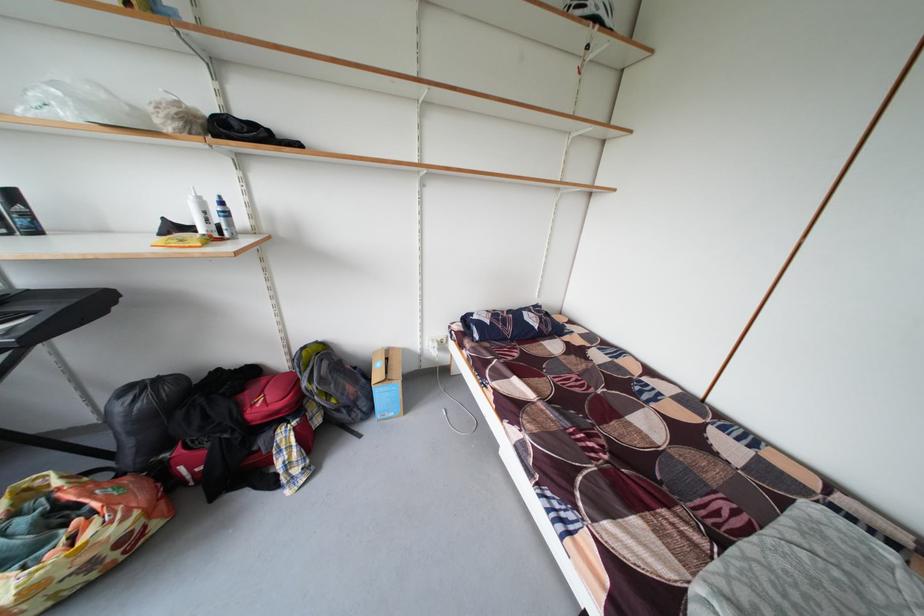
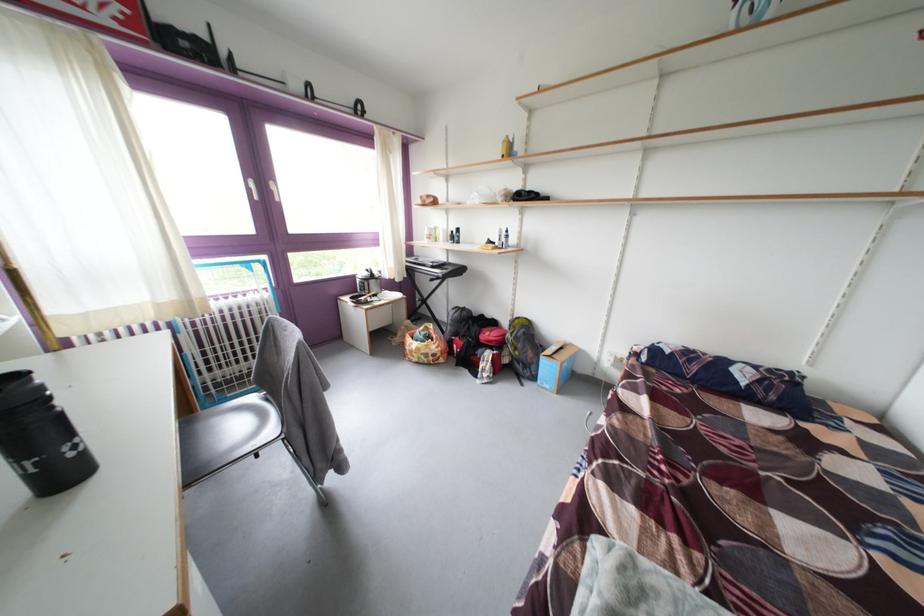
Question: The camera is either moving clockwise (left) or counter-clockwise (right) around the object. The first image is from the beginning of the video and the second image is from the end. Is the camera moving left or right when shooting the video?

Choices:
 (A) Left
 (B) Right

Answer: (B)